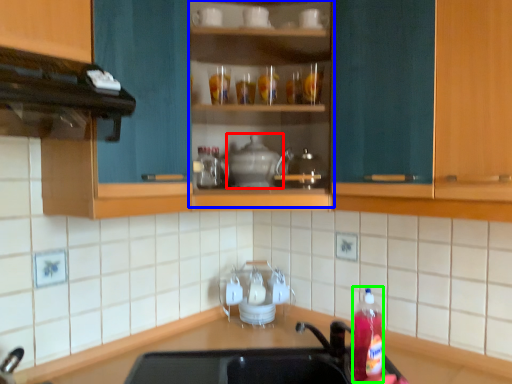
Question: Estimate the real-world distances between objects in this image. Which object is farther from appliance (highlighted by a red box), cabinet (highlighted by a blue box) or bottle (highlighted by a green box)?

Choices:
 (A) cabinet
 (B) bottle

Answer: (B)